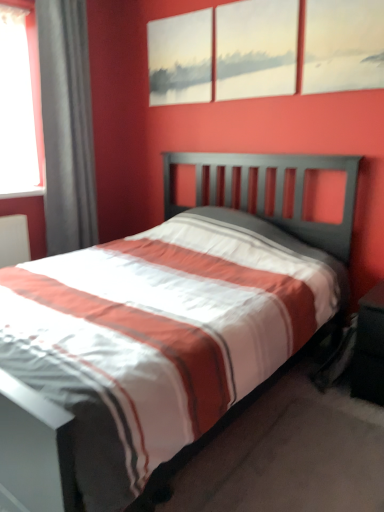
What do you see at coordinates (180, 58) in the screenshot? Image resolution: width=384 pixels, height=512 pixels. I see `matte gray painting at upper center, positioned as the 1th picture frame in left-to-right order` at bounding box center [180, 58].

How much space does matte gray painting at upper center, positioned as the 1th picture frame in left-to-right order, occupy horizontally?

1.76 inches.

I want to click on white striped fabric at center, so click(174, 318).

What do you see at coordinates (67, 126) in the screenshot?
I see `gray fabric curtain at left` at bounding box center [67, 126].

This screenshot has width=384, height=512. Describe the element at coordinates (343, 45) in the screenshot. I see `matte canvas painting at upper center, the first picture frame in the right-to-left sequence` at that location.

The width and height of the screenshot is (384, 512). Find the location of `matte canvas painting at upper center, the first picture frame in the right-to-left sequence`. matte canvas painting at upper center, the first picture frame in the right-to-left sequence is located at coordinates (343, 45).

At what (x,y) coordinates should I click in order to perform the action: click on matte white canvas at upper center, the 2th picture frame positioned from the left. Please return your answer as a coordinate pair (x, y). The image size is (384, 512). Looking at the image, I should click on pos(256,48).

Image resolution: width=384 pixels, height=512 pixels. I want to click on matte gray painting at upper center, marked as the 3th picture frame in a right-to-left arrangement, so click(x=180, y=58).

How much distance is there between gray fabric curtain at left and matte white canvas at upper center, the second picture frame positioned from the right?

gray fabric curtain at left is 3.75 feet away from matte white canvas at upper center, the second picture frame positioned from the right.

Locate an element on the screen. The image size is (384, 512). picture frame that is the 2nd object to the right of the gray fabric curtain at left, starting at the anchor is located at coordinates (256, 48).

Can you confirm if gray fabric curtain at left is smaller than matte white canvas at upper center, the second picture frame positioned from the right?

No.

Can you tell me how much gray fabric curtain at left and matte white canvas at upper center, the second picture frame positioned from the right, differ in facing direction?

They differ by 91.2 degrees in their facing directions.

Considering the relative sizes of gray fabric curtain at left and black matte nightstand at lower right in the image provided, is gray fabric curtain at left bigger than black matte nightstand at lower right?

Correct, gray fabric curtain at left is larger in size than black matte nightstand at lower right.

From a real-world perspective, relative to black matte nightstand at lower right, is gray fabric curtain at left vertically above or below?

In terms of real-world spatial position, gray fabric curtain at left is above black matte nightstand at lower right.

Could you tell me if gray fabric curtain at left is facing black matte nightstand at lower right?

Yes, gray fabric curtain at left is facing black matte nightstand at lower right.

Based on the photo, from a real-world perspective, who is located higher, matte canvas painting at upper center, arranged as the 3th picture frame when viewed from the left, or matte white canvas at upper center, the second picture frame positioned from the right?

matte white canvas at upper center, the second picture frame positioned from the right.

From the image's perspective, relative to matte white canvas at upper center, the 2th picture frame positioned from the left, is matte canvas painting at upper center, arranged as the 3th picture frame when viewed from the left, above or below?

matte canvas painting at upper center, arranged as the 3th picture frame when viewed from the left, is situated lower than matte white canvas at upper center, the 2th picture frame positioned from the left, in the image.

Is matte canvas painting at upper center, the first picture frame in the right-to-left sequence, beside matte white canvas at upper center, the second picture frame positioned from the right?

No, matte canvas painting at upper center, the first picture frame in the right-to-left sequence, is not in contact with matte white canvas at upper center, the second picture frame positioned from the right.

Considering the relative positions of matte gray painting at upper center, positioned as the 1th picture frame in left-to-right order, and matte canvas painting at upper center, arranged as the 3th picture frame when viewed from the left, in the image provided, is matte gray painting at upper center, positioned as the 1th picture frame in left-to-right order, to the left or to the right of matte canvas painting at upper center, arranged as the 3th picture frame when viewed from the left,?

matte gray painting at upper center, positioned as the 1th picture frame in left-to-right order, is to the left of matte canvas painting at upper center, arranged as the 3th picture frame when viewed from the left.

Is matte gray painting at upper center, positioned as the 1th picture frame in left-to-right order, behind matte canvas painting at upper center, arranged as the 3th picture frame when viewed from the left?

Yes, matte gray painting at upper center, positioned as the 1th picture frame in left-to-right order, is further from the camera.

Find the location of a particular element. Image resolution: width=384 pixels, height=512 pixels. the 2nd picture frame to the right of the matte gray painting at upper center, marked as the 3th picture frame in a right-to-left arrangement, starting your count from the anchor is located at coordinates (343, 45).

From the image's perspective, is matte gray painting at upper center, positioned as the 1th picture frame in left-to-right order, under matte canvas painting at upper center, the first picture frame in the right-to-left sequence?

Incorrect, from the image's perspective, matte gray painting at upper center, positioned as the 1th picture frame in left-to-right order, is higher than matte canvas painting at upper center, the first picture frame in the right-to-left sequence.

What's the angular difference between black matte nightstand at lower right and white striped fabric at center's facing directions?

The angular difference between black matte nightstand at lower right and white striped fabric at center is 179 degrees.

From their relative heights in the image, would you say black matte nightstand at lower right is taller or shorter than white striped fabric at center?

In the image, black matte nightstand at lower right appears to be taller than white striped fabric at center.

Is white striped fabric at center located within black matte nightstand at lower right?

No.

Does black matte nightstand at lower right have a lesser width compared to white striped fabric at center?

Correct, the width of black matte nightstand at lower right is less than that of white striped fabric at center.

Considering the points (363, 390) and (337, 65), which point is behind, point (363, 390) or point (337, 65)?

Positioned behind is point (337, 65).

From the image's perspective, does black matte nightstand at lower right appear higher than matte canvas painting at upper center, arranged as the 3th picture frame when viewed from the left?

Incorrect, from the image's perspective, black matte nightstand at lower right is lower than matte canvas painting at upper center, arranged as the 3th picture frame when viewed from the left.

Which object is closer to the camera taking this photo, black matte nightstand at lower right or matte canvas painting at upper center, the first picture frame in the right-to-left sequence?

black matte nightstand at lower right is closer to the camera.

Is black matte nightstand at lower right not inside matte canvas painting at upper center, arranged as the 3th picture frame when viewed from the left?

Indeed, black matte nightstand at lower right is completely outside matte canvas painting at upper center, arranged as the 3th picture frame when viewed from the left.

Is point (173, 83) behind point (354, 384)?

Yes, it is behind point (354, 384).

From the image's perspective, who appears lower, matte gray painting at upper center, marked as the 3th picture frame in a right-to-left arrangement, or black matte nightstand at lower right?

From the image's view, black matte nightstand at lower right is below.

In the scene shown: Is there a large distance between matte gray painting at upper center, positioned as the 1th picture frame in left-to-right order, and black matte nightstand at lower right?

Yes, matte gray painting at upper center, positioned as the 1th picture frame in left-to-right order, and black matte nightstand at lower right are quite far apart.

At what (x,y) coordinates should I click in order to perform the action: click on curtain below the matte white canvas at upper center, the 2th picture frame positioned from the left (from a real-world perspective). Please return your answer as a coordinate pair (x, y). The height and width of the screenshot is (512, 384). Looking at the image, I should click on (67, 126).

The width and height of the screenshot is (384, 512). Identify the location of curtain to the left of black matte nightstand at lower right. (67, 126).

When comparing their distances from gray fabric curtain at left, does matte canvas painting at upper center, arranged as the 3th picture frame when viewed from the left, or white striped fabric at center seem further?

matte canvas painting at upper center, arranged as the 3th picture frame when viewed from the left, is further to gray fabric curtain at left.

From the picture: From the image, which object appears to be farther from matte gray painting at upper center, positioned as the 1th picture frame in left-to-right order, matte white canvas at upper center, the 2th picture frame positioned from the left, or gray fabric curtain at left?

gray fabric curtain at left.

When comparing their distances from black matte nightstand at lower right, does matte gray painting at upper center, positioned as the 1th picture frame in left-to-right order, or matte white canvas at upper center, the 2th picture frame positioned from the left, seem further?

matte gray painting at upper center, positioned as the 1th picture frame in left-to-right order.

From the image, which object appears to be nearer to matte canvas painting at upper center, the first picture frame in the right-to-left sequence, matte white canvas at upper center, the second picture frame positioned from the right, or matte gray painting at upper center, positioned as the 1th picture frame in left-to-right order?

Among the two, matte white canvas at upper center, the second picture frame positioned from the right, is located nearer to matte canvas painting at upper center, the first picture frame in the right-to-left sequence.

When comparing their distances from matte gray painting at upper center, marked as the 3th picture frame in a right-to-left arrangement, does black matte nightstand at lower right or white striped fabric at center seem further?

black matte nightstand at lower right is positioned further to the anchor matte gray painting at upper center, marked as the 3th picture frame in a right-to-left arrangement.

Which object lies nearer to the anchor point matte gray painting at upper center, marked as the 3th picture frame in a right-to-left arrangement, matte canvas painting at upper center, arranged as the 3th picture frame when viewed from the left, or matte white canvas at upper center, the second picture frame positioned from the right?

Among the two, matte white canvas at upper center, the second picture frame positioned from the right, is located nearer to matte gray painting at upper center, marked as the 3th picture frame in a right-to-left arrangement.

Looking at the image, which one is located further to black matte nightstand at lower right, matte white canvas at upper center, the second picture frame positioned from the right, or white striped fabric at center?

The object further to black matte nightstand at lower right is matte white canvas at upper center, the second picture frame positioned from the right.

Considering their positions, is matte white canvas at upper center, the 2th picture frame positioned from the left, positioned further to white striped fabric at center than matte canvas painting at upper center, the first picture frame in the right-to-left sequence?

matte white canvas at upper center, the 2th picture frame positioned from the left, is positioned further to the anchor white striped fabric at center.

This screenshot has height=512, width=384. I want to click on curtain between matte gray painting at upper center, marked as the 3th picture frame in a right-to-left arrangement, and white striped fabric at center in the up-down direction, so click(67, 126).

Image resolution: width=384 pixels, height=512 pixels. Find the location of `picture frame situated between matte gray painting at upper center, marked as the 3th picture frame in a right-to-left arrangement, and matte canvas painting at upper center, the first picture frame in the right-to-left sequence, from left to right`. picture frame situated between matte gray painting at upper center, marked as the 3th picture frame in a right-to-left arrangement, and matte canvas painting at upper center, the first picture frame in the right-to-left sequence, from left to right is located at coordinates (256, 48).

Where is `curtain between matte canvas painting at upper center, the first picture frame in the right-to-left sequence, and white striped fabric at center in the up-down direction`? The height and width of the screenshot is (512, 384). curtain between matte canvas painting at upper center, the first picture frame in the right-to-left sequence, and white striped fabric at center in the up-down direction is located at coordinates (67, 126).

You are a GUI agent. You are given a task and a screenshot of the screen. Output one action in this format:
    pyautogui.click(x=<x>, y=<y>)
    Task: Click on the bed located between gray fabric curtain at left and black matte nightstand at lower right in the left-right direction
    This screenshot has width=384, height=512.
    Given the screenshot: What is the action you would take?
    pyautogui.click(x=174, y=318)